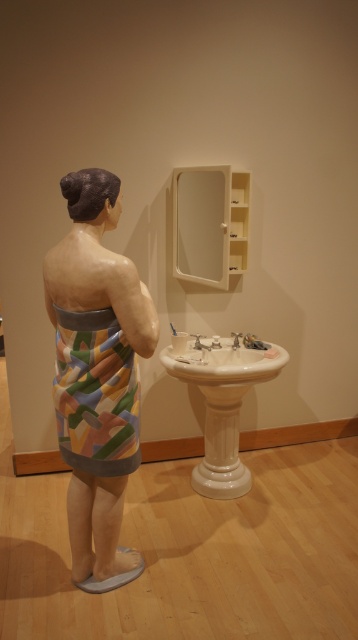
You are designing a bathroom layout and need to place a new decorative item on the countertop. Considering the white glossy sink at lower center and the silver metallic faucet at lower center, which object should you avoid placing something near if you want to ensure there is enough space?

You should avoid placing the new decorative item near the white glossy sink at lower center because it is larger in size than the silver metallic faucet at lower center, leaving less space around it.

You are a person standing in the bathroom and want to wash your hands. The white glossy sink at lower center and the silver metallic faucet at sink center are in your view. Which object should you turn on to start the water flow?

The silver metallic faucet at sink center is the one you should turn on to start the water flow, as it is positioned above the white glossy sink at lower center and is typically used for controlling water flow in such setups.